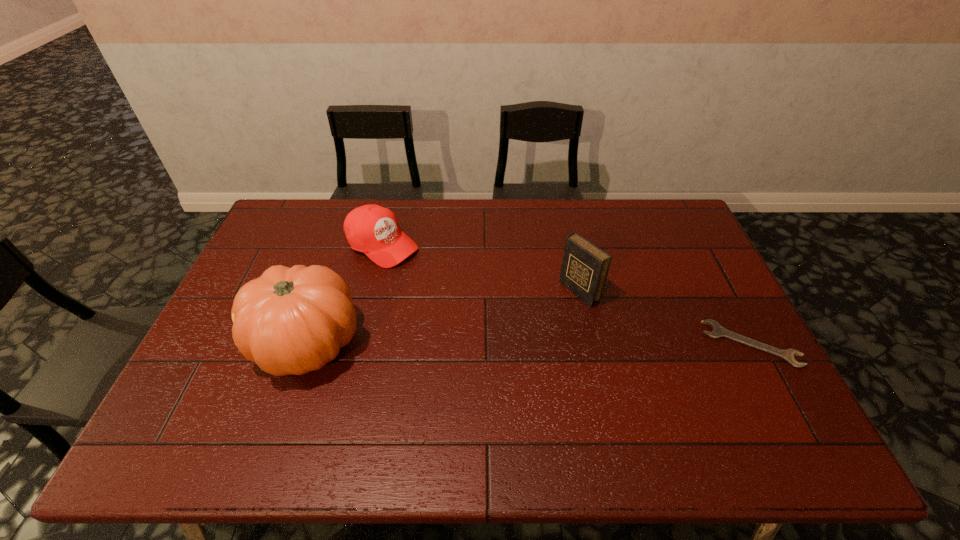
At what (x,y) coordinates should I click in order to perform the action: click on free space on the desktop that is between the tallest object and the shortest object and is positioned on the front cover of the second object from right to left. Please return your answer as a coordinate pair (x, y). The image size is (960, 540). Looking at the image, I should click on (497, 345).

You are a GUI agent. You are given a task and a screenshot of the screen. Output one action in this format:
    pyautogui.click(x=<x>, y=<y>)
    Task: Click on the free space on the desktop that is between the pumpkin and the shortest object and is positioned on the front panel of the farthest object
    Image resolution: width=960 pixels, height=540 pixels.
    Given the screenshot: What is the action you would take?
    pyautogui.click(x=540, y=345)